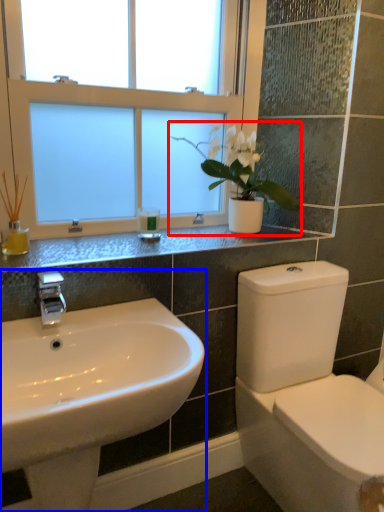
Question: Which of the following is the closest to the observer, houseplant (highlighted by a red box) or sink (highlighted by a blue box)?

Choices:
 (A) houseplant
 (B) sink

Answer: (B)